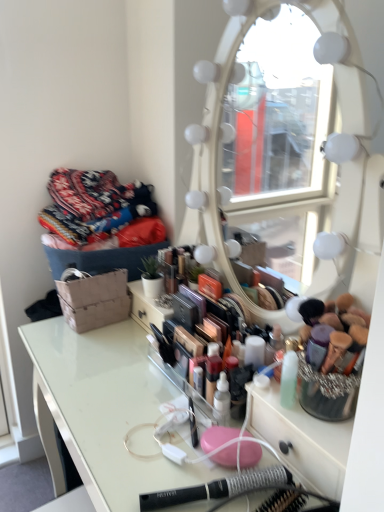
Question: Can we say clear acrylic table at center lies outside knitted fabric pile at upper left?

Choices:
 (A) yes
 (B) no

Answer: (A)

Question: Is clear acrylic table at center bigger than knitted fabric pile at upper left?

Choices:
 (A) no
 (B) yes

Answer: (B)

Question: From a real-world perspective, is clear acrylic table at center on top of knitted fabric pile at upper left?

Choices:
 (A) no
 (B) yes

Answer: (A)

Question: From a real-world perspective, is clear acrylic table at center under knitted fabric pile at upper left?

Choices:
 (A) yes
 (B) no

Answer: (A)

Question: Is clear acrylic table at center at the left side of knitted fabric pile at upper left?

Choices:
 (A) no
 (B) yes

Answer: (A)

Question: Is clear acrylic table at center next to knitted fabric pile at upper left and touching it?

Choices:
 (A) no
 (B) yes

Answer: (A)

Question: Does black plastic hairbrush at lower center lie in front of knitted fabric pile at upper left?

Choices:
 (A) yes
 (B) no

Answer: (A)

Question: Can you confirm if black plastic hairbrush at lower center is taller than knitted fabric pile at upper left?

Choices:
 (A) no
 (B) yes

Answer: (A)

Question: Does black plastic hairbrush at lower center turn towards knitted fabric pile at upper left?

Choices:
 (A) yes
 (B) no

Answer: (B)

Question: Considering the relative positions of black plastic hairbrush at lower center and knitted fabric pile at upper left in the image provided, is black plastic hairbrush at lower center to the right of knitted fabric pile at upper left from the viewer's perspective?

Choices:
 (A) yes
 (B) no

Answer: (A)

Question: Could knitted fabric pile at upper left be considered to be inside black plastic hairbrush at lower center?

Choices:
 (A) no
 (B) yes

Answer: (A)

Question: Is black plastic hairbrush at lower center to the left of knitted fabric pile at upper left from the viewer's perspective?

Choices:
 (A) no
 (B) yes

Answer: (A)

Question: Can you confirm if knitted fabric pile at upper left is taller than clear acrylic table at center?

Choices:
 (A) no
 (B) yes

Answer: (A)